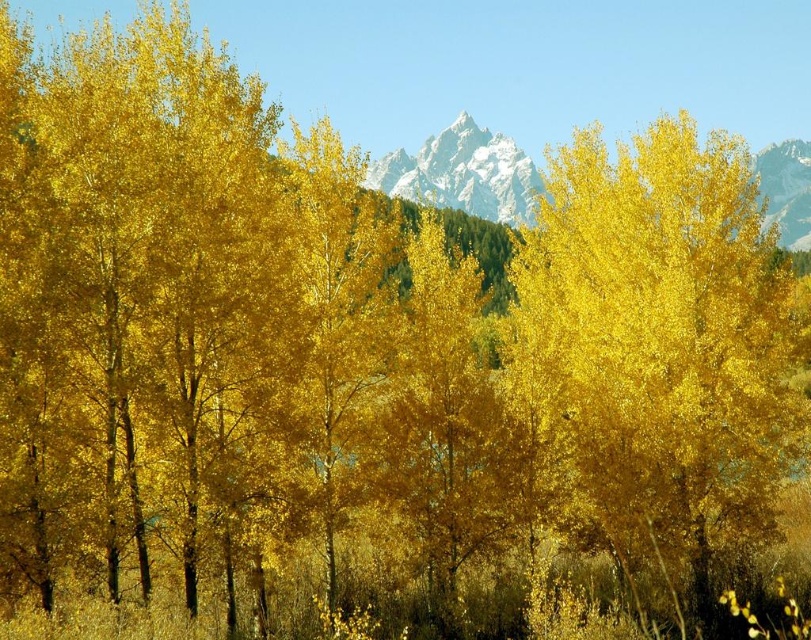
Can you confirm if golden glossy tree at center is positioned above white crystalline mountain at center?

Actually, golden glossy tree at center is below white crystalline mountain at center.

Which is in front, point (653, 276) or point (479, 189)?

Positioned in front is point (653, 276).

The width and height of the screenshot is (811, 640). Identify the location of golden glossy tree at center. (659, 346).